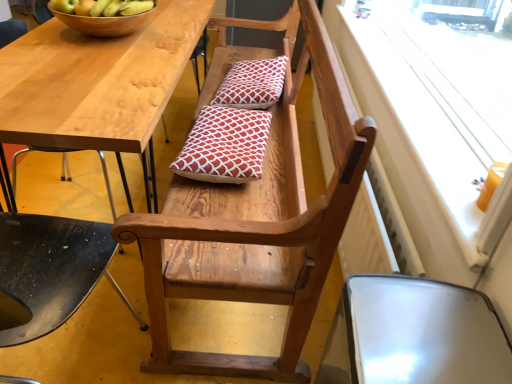
This screenshot has height=384, width=512. I want to click on vacant region above metallic silver chair at lower right, which is counted as the 3th chair, starting from the left (from a real-world perspective), so click(421, 322).